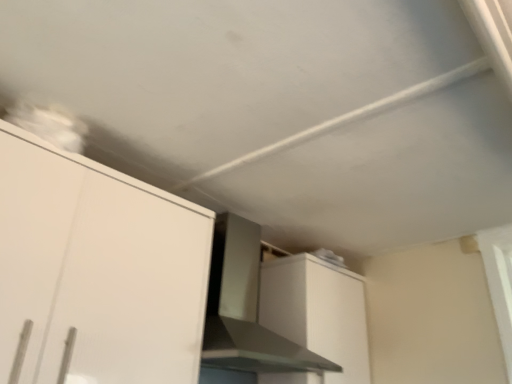
Question: Relative to white matte cabinet at upper right, which appears as the second cabinetry when viewed from the left, is white matte cabinet at upper left, which is counted as the first cabinetry, starting from the front, in front or behind?

Choices:
 (A) behind
 (B) front

Answer: (B)

Question: Is white matte cabinet at upper left, the first cabinetry in the left-to-right sequence, wider or thinner than white matte cabinet at upper right, the 1th cabinetry from the back?

Choices:
 (A) thin
 (B) wide

Answer: (B)

Question: Which object is positioned farthest from the satin silver vent at center?

Choices:
 (A) white matte cabinet at upper right, the first cabinetry positioned from the right
 (B) white matte cabinet at upper left, which is counted as the second cabinetry, starting from the right

Answer: (B)

Question: Considering the real-world distances, which object is farthest from the white matte cabinet at upper left, which is counted as the first cabinetry, starting from the front?

Choices:
 (A) white matte cabinet at upper right, which appears as the second cabinetry when viewed from the left
 (B) satin silver vent at center

Answer: (A)